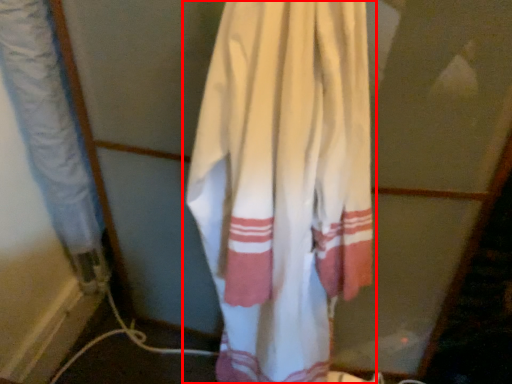
Question: From the image's perspective, what is the correct spatial positioning of curtain (annotated by the red box) in reference to curtain?

Choices:
 (A) below
 (B) above

Answer: (A)